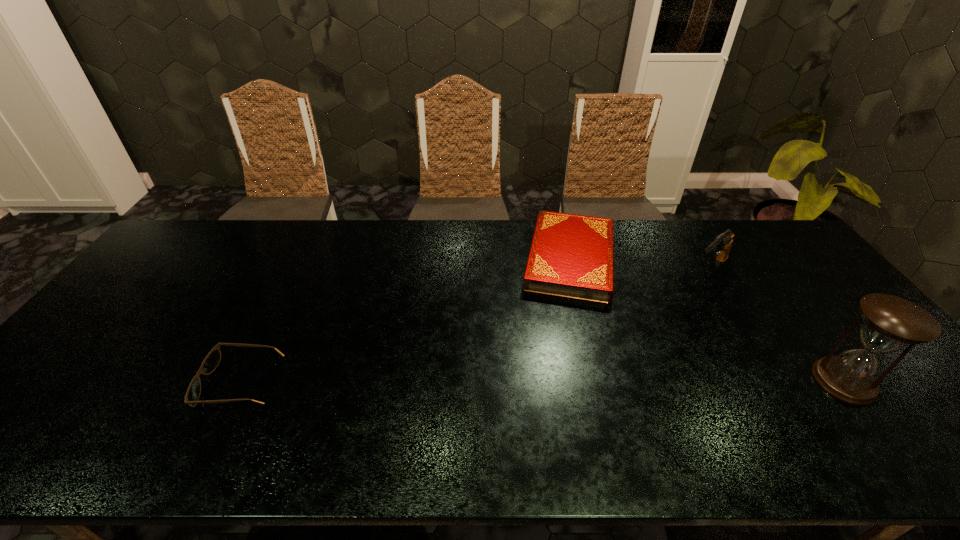
This screenshot has width=960, height=540. In order to click on free space that satisfies the following two spatial constraints: 1. on the front side of the third object from left to right; 2. on the left side of the hardback book in this screenshot , I will do `click(573, 269)`.

Identify the location of free point that satisfies the following two spatial constraints: 1. on the front side of the third object from right to left; 2. on the left side of the gun. This screenshot has width=960, height=540. (573, 269).